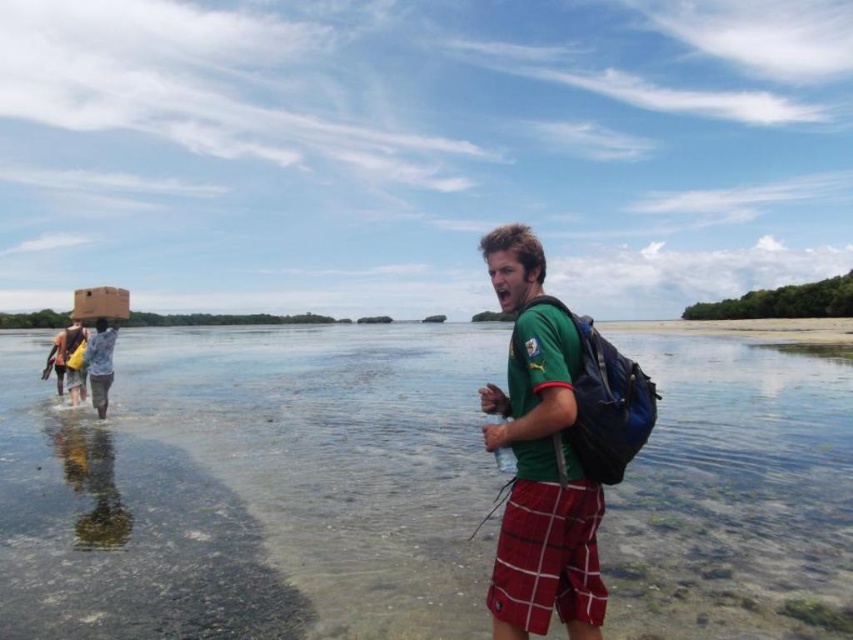
From the picture: You are a photographer trying to capture the scene at the shallow coastal area. You want to focus on the clear water at center located at point (251, 486). However, there is a man standing in the foreground. Is the man blocking your view of the clear water at center?

The clear water at center is located at point (251, 486). Since the man is in the foreground, he is likely blocking the view of the clear water at center.